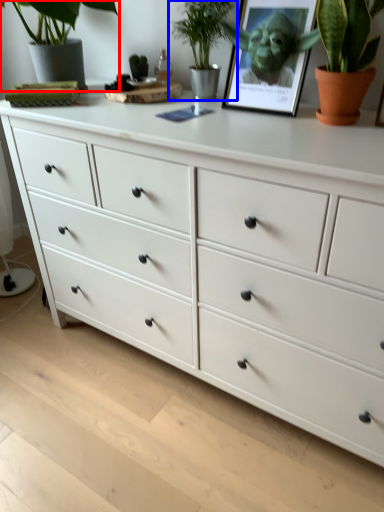
Question: Which point is further to the camera, houseplant (highlighted by a red box) or houseplant (highlighted by a blue box)?

Choices:
 (A) houseplant
 (B) houseplant

Answer: (B)